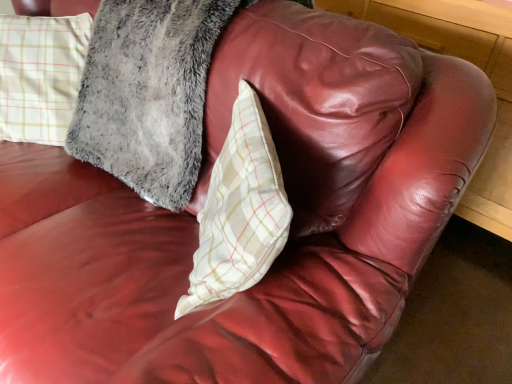
Question: Is white plaid pillow at center, the first pillow when ordered from right to left, to the left or to the right of plaid fabric pillow at upper left, arranged as the first pillow when viewed from the left, in the image?

Choices:
 (A) left
 (B) right

Answer: (B)

Question: Does point (230, 254) appear closer or farther from the camera than point (169, 165)?

Choices:
 (A) farther
 (B) closer

Answer: (B)

Question: In the image, is white plaid pillow at center, marked as the second pillow in a left-to-right arrangement, positioned in front of or behind plaid fabric pillow at upper left, the second pillow from the right?

Choices:
 (A) front
 (B) behind

Answer: (A)

Question: From a real-world perspective, is plaid fabric pillow at upper left, arranged as the first pillow when viewed from the left, positioned above or below white plaid pillow at center, the first pillow when ordered from right to left?

Choices:
 (A) above
 (B) below

Answer: (A)

Question: Is point (151, 148) positioned closer to the camera than point (216, 281)?

Choices:
 (A) closer
 (B) farther

Answer: (B)

Question: From the image's perspective, relative to white plaid pillow at center, the first pillow when ordered from right to left, is plaid fabric pillow at upper left, the second pillow from the right, above or below?

Choices:
 (A) below
 (B) above

Answer: (B)

Question: Would you say plaid fabric pillow at upper left, arranged as the first pillow when viewed from the left, is to the left or to the right of white plaid pillow at center, marked as the second pillow in a left-to-right arrangement, in the picture?

Choices:
 (A) right
 (B) left

Answer: (B)